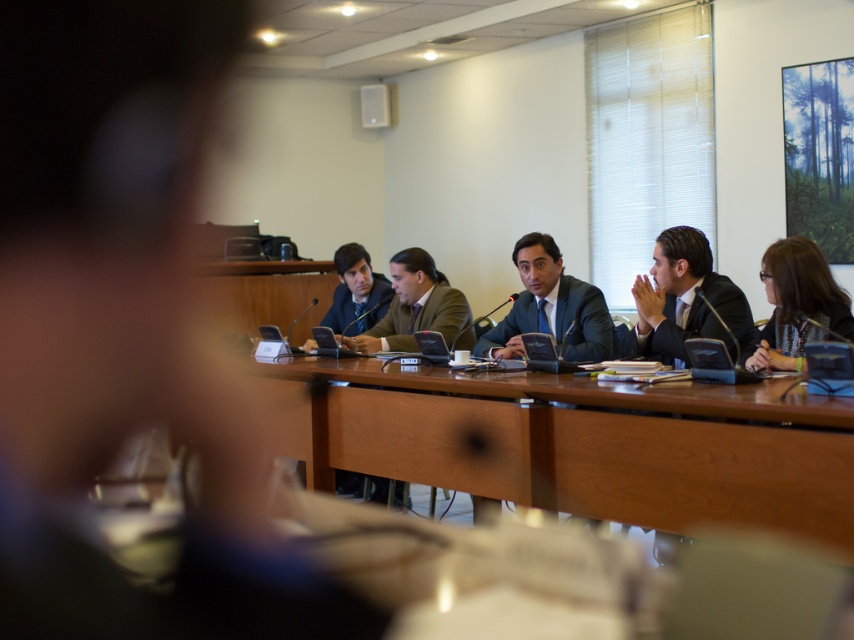
Who is more forward, (679, 273) or (360, 276)?

Positioned in front is point (679, 273).

Can you confirm if matte black suit at right is positioned to the left of matte black suit at center?

No, matte black suit at right is not to the left of matte black suit at center.

At what (x,y) coordinates should I click in order to perform the action: click on matte black suit at right. Please return your answer as a coordinate pair (x, y). Looking at the image, I should click on (688, 300).

Locate an element on the screen. brown wood table at center is located at coordinates (578, 444).

Is brown wood table at center thinner than matte black suit at right?

Incorrect, brown wood table at center's width is not less than matte black suit at right's.

The image size is (854, 640). What do you see at coordinates (578, 444) in the screenshot?
I see `brown wood table at center` at bounding box center [578, 444].

At what (x,y) coordinates should I click in order to perform the action: click on brown wood table at center. Please return your answer as a coordinate pair (x, y). Image resolution: width=854 pixels, height=640 pixels. Looking at the image, I should click on (578, 444).

The height and width of the screenshot is (640, 854). What do you see at coordinates (688, 300) in the screenshot?
I see `matte black suit at right` at bounding box center [688, 300].

Is matte black suit at right thinner than patterned fabric jacket at lower right?

Incorrect, matte black suit at right's width is not less than patterned fabric jacket at lower right's.

Measure the distance between point (695,241) and camera.

Point (695,241) and camera are 3.46 meters apart.

Where is `matte black suit at right`? matte black suit at right is located at coordinates (688, 300).